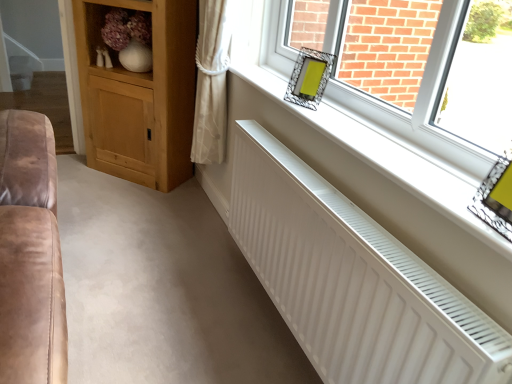
Identify the location of vacant area that lies to the right of metallic silver picture frame at upper right, the second picture frame when ordered from right to left. Image resolution: width=512 pixels, height=384 pixels. (341, 109).